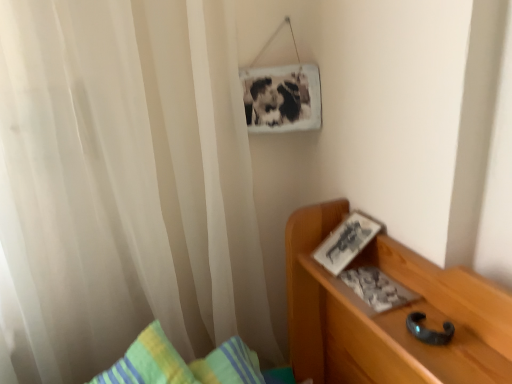
Question: Is white paper book at right facing towards white sheer curtain at left?

Choices:
 (A) yes
 (B) no

Answer: (B)

Question: Does white paper book at right have a smaller size compared to white sheer curtain at left?

Choices:
 (A) no
 (B) yes

Answer: (B)

Question: Is white sheer curtain at left a part of white paper book at right?

Choices:
 (A) yes
 (B) no

Answer: (B)

Question: Is white paper book at right taller than white sheer curtain at left?

Choices:
 (A) no
 (B) yes

Answer: (A)

Question: Does white paper book at right have a lesser width compared to white sheer curtain at left?

Choices:
 (A) no
 (B) yes

Answer: (B)

Question: From the image's perspective, is white paper book at right under white sheer curtain at left?

Choices:
 (A) yes
 (B) no

Answer: (A)

Question: Is white sheer curtain at left oriented towards white paper book at right?

Choices:
 (A) yes
 (B) no

Answer: (A)

Question: Is white sheer curtain at left positioned behind white paper book at right?

Choices:
 (A) yes
 (B) no

Answer: (B)

Question: From a real-world perspective, is white sheer curtain at left under white paper book at right?

Choices:
 (A) yes
 (B) no

Answer: (B)

Question: From the image's perspective, would you say white sheer curtain at left is shown under white paper book at right?

Choices:
 (A) no
 (B) yes

Answer: (A)

Question: From a real-world perspective, is white sheer curtain at left over white paper book at right?

Choices:
 (A) no
 (B) yes

Answer: (B)

Question: Can you confirm if white sheer curtain at left is bigger than white paper book at right?

Choices:
 (A) no
 (B) yes

Answer: (B)

Question: Based on their positions, is white paper book at right located to the left or right of white sheer curtain at left?

Choices:
 (A) left
 (B) right

Answer: (B)